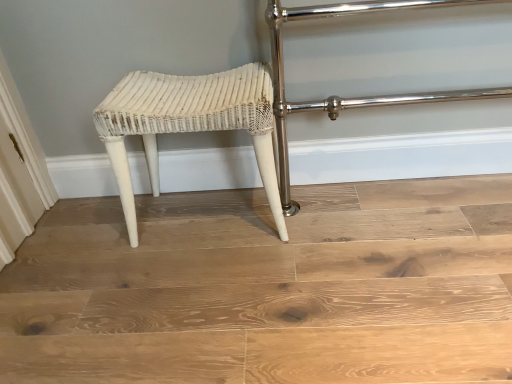
Measure the distance between white wicker stool at center and camera.

white wicker stool at center is 1.05 meters away from camera.

What do you see at coordinates (188, 123) in the screenshot?
I see `white wicker stool at center` at bounding box center [188, 123].

The width and height of the screenshot is (512, 384). I want to click on white wicker stool at center, so click(x=188, y=123).

The image size is (512, 384). Describe the element at coordinates (268, 288) in the screenshot. I see `white wicker stool at center` at that location.

I want to click on white wicker stool at center, so click(x=268, y=288).

Where is `white wicker stool at center`? white wicker stool at center is located at coordinates (188, 123).

Does white wicker stool at center appear on the right side of white wicker stool at center?

Incorrect, white wicker stool at center is not on the right side of white wicker stool at center.

Relative to white wicker stool at center, is white wicker stool at center in front or behind?

In the image, white wicker stool at center appears behind white wicker stool at center.

Considering the points (203, 92) and (71, 250), which point is behind, point (203, 92) or point (71, 250)?

The point (71, 250) is farther.

From the image's perspective, is white wicker stool at center positioned above or below white wicker stool at center?

Clearly, from the image's perspective, white wicker stool at center is above white wicker stool at center.

From a real-world perspective, between white wicker stool at center and white wicker stool at center, who is vertically lower?

white wicker stool at center is physically lower.

Which object is thinner, white wicker stool at center or white wicker stool at center?

With smaller width is white wicker stool at center.

Considering the sizes of objects white wicker stool at center and white wicker stool at center in the image provided, who is shorter, white wicker stool at center or white wicker stool at center?

With less height is white wicker stool at center.

Between white wicker stool at center and white wicker stool at center, which one has larger size?

Bigger between the two is white wicker stool at center.

Is white wicker stool at center situated inside white wicker stool at center or outside?

white wicker stool at center cannot be found inside white wicker stool at center.

Is white wicker stool at center far away from white wicker stool at center?

That's not correct — white wicker stool at center is a little close to white wicker stool at center.

Could you tell me if white wicker stool at center is facing white wicker stool at center?

No, white wicker stool at center is not turned towards white wicker stool at center.

What's the angular difference between white wicker stool at center and white wicker stool at center's facing directions?

They differ by 2.13 degrees in their facing directions.

The image size is (512, 384). In the image, there is a white wicker stool at center. Identify the location of stool above it (from the image's perspective). (188, 123).

Is white wicker stool at center at the right side of white wicker stool at center?

Indeed, white wicker stool at center is positioned on the right side of white wicker stool at center.

Is white wicker stool at center in front of white wicker stool at center?

That is True.

Considering the points (32, 242) and (262, 165), which point is in front, point (32, 242) or point (262, 165)?

Positioned in front is point (262, 165).

From the image's perspective, would you say white wicker stool at center is shown under white wicker stool at center?

Yes, from the image's perspective, white wicker stool at center is below white wicker stool at center.

From a real-world perspective, is white wicker stool at center positioned over white wicker stool at center based on gravity?

No, from a real-world perspective, white wicker stool at center is not above white wicker stool at center.

Between white wicker stool at center and white wicker stool at center, which one has larger width?

white wicker stool at center.

Is white wicker stool at center taller or shorter than white wicker stool at center?

Clearly, white wicker stool at center is shorter compared to white wicker stool at center.

Looking at this image, between white wicker stool at center and white wicker stool at center, which one has larger size?

Bigger between the two is white wicker stool at center.

Can we say white wicker stool at center lies outside white wicker stool at center?

white wicker stool at center is positioned outside white wicker stool at center.

Is white wicker stool at center directly adjacent to white wicker stool at center?

No, white wicker stool at center is not in contact with white wicker stool at center.

Does white wicker stool at center turn towards white wicker stool at center?

No, white wicker stool at center is not turned towards white wicker stool at center.

Identify the location of stairwell lying on the right of white wicker stool at center. (268, 288).

The image size is (512, 384). Identify the location of stairwell below the white wicker stool at center (from a real-world perspective). (268, 288).

The image size is (512, 384). Find the location of `stairwell in front of the white wicker stool at center`. stairwell in front of the white wicker stool at center is located at coordinates click(268, 288).